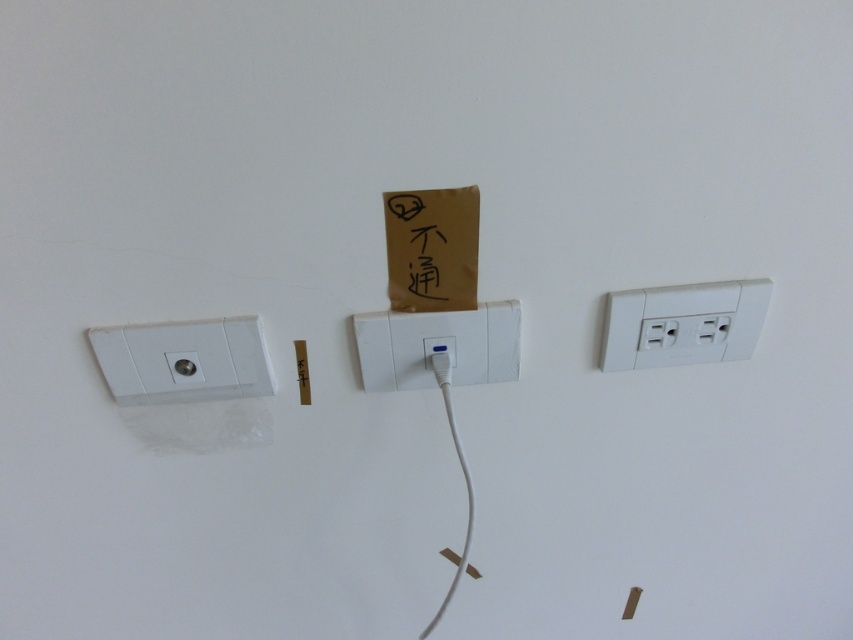
Question: Can you confirm if white plastic socket at left is wider than white plastic electric outlet at right?

Choices:
 (A) no
 (B) yes

Answer: (A)

Question: Is white plastic socket at left to the left of white plastic usb port at center from the viewer's perspective?

Choices:
 (A) no
 (B) yes

Answer: (B)

Question: Among these objects, which one is nearest to the camera?

Choices:
 (A) white plastic socket at left
 (B) white plastic electric outlet at right
 (C) white plastic usb port at center

Answer: (A)

Question: Among these points, which one is farthest from the camera?

Choices:
 (A) (451, 374)
 (B) (682, 285)

Answer: (A)

Question: Which of the following is the closest to the observer?

Choices:
 (A) (451, 374)
 (B) (643, 328)
 (C) (160, 378)

Answer: (C)

Question: Is white plastic electric outlet at right above white plastic usb port at center?

Choices:
 (A) yes
 (B) no

Answer: (A)